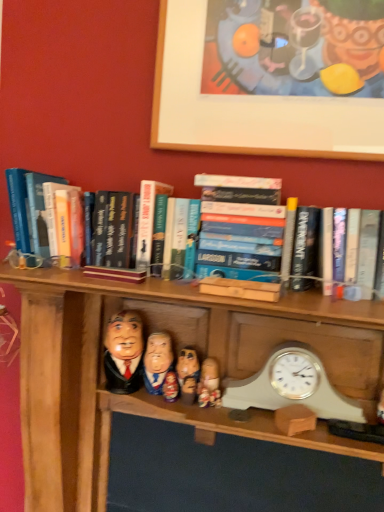
The image size is (384, 512). What do you see at coordinates (204, 398) in the screenshot? I see `wooden figurine at center, the 1th toy from the right` at bounding box center [204, 398].

The height and width of the screenshot is (512, 384). What do you see at coordinates (240, 228) in the screenshot?
I see `hardcover book at center` at bounding box center [240, 228].

What do you see at coordinates (350, 251) in the screenshot? I see `hardcover books at right` at bounding box center [350, 251].

What do you see at coordinates (247, 106) in the screenshot? I see `wooden picture frame at upper center` at bounding box center [247, 106].

Find the location of a particular element. matte plastic head at center, the 1th person viewed from the left is located at coordinates (124, 352).

Considering their positions, is matte plastic head at center, the fourth person in the right-to-left sequence, located in front of or behind hardcover book at center?

In the image, matte plastic head at center, the fourth person in the right-to-left sequence, appears behind hardcover book at center.

Is matte plastic head at center, the fourth person in the right-to-left sequence, oriented towards hardcover book at center?

No, matte plastic head at center, the fourth person in the right-to-left sequence, is not aimed at hardcover book at center.

Does matte plastic head at center, the 1th person viewed from the left, appear on the right side of hardcover book at center?

In fact, matte plastic head at center, the 1th person viewed from the left, is to the left of hardcover book at center.

Between wooden picture frame at upper center and matte plastic head at center, the 1th person viewed from the left, which one has smaller width?

With smaller width is wooden picture frame at upper center.

Is wooden picture frame at upper center bigger than matte plastic head at center, the fourth person in the right-to-left sequence?

A: Yes.

Is matte plastic head at center, the 1th person viewed from the left, inside wooden picture frame at upper center?

No, matte plastic head at center, the 1th person viewed from the left, is located outside of wooden picture frame at upper center.

Identify the location of picture frame that appears above the matte plastic head at center, the 1th person viewed from the left (from a real-world perspective). (247, 106).

Considering the positions of objects wooden doll at center, arranged as the first toy when viewed from the left, and hardcover books at right in the image provided, who is more to the left, wooden doll at center, arranged as the first toy when viewed from the left, or hardcover books at right?

Positioned to the left is wooden doll at center, arranged as the first toy when viewed from the left.

Which is in front, point (168, 374) or point (362, 232)?

The point (362, 232) is closer.

Could you measure the distance between wooden doll at center, which is the 3th toy in right-to-left order, and hardcover books at right?

The distance of wooden doll at center, which is the 3th toy in right-to-left order, from hardcover books at right is 19.38 inches.

Would you say hardcover books at right is part of wooden doll at center, which is the 3th toy in right-to-left order,'s contents?

No, hardcover books at right is not surrounded by wooden doll at center, which is the 3th toy in right-to-left order.

Looking at their sizes, would you say hardcover book at center is wider or thinner than wooden figurine at center, arranged as the second toy when viewed from the right?

Clearly, hardcover book at center has more width compared to wooden figurine at center, arranged as the second toy when viewed from the right.

Is wooden figurine at center, arranged as the second toy when viewed from the right, located within hardcover book at center?

No, wooden figurine at center, arranged as the second toy when viewed from the right, is not surrounded by hardcover book at center.

In the scene shown: From a real-world perspective, does hardcover book at center sit lower than wooden figurine at center, arranged as the second toy when viewed from the right?

Incorrect, from a real-world perspective, hardcover book at center is higher than wooden figurine at center, arranged as the second toy when viewed from the right.

Does hardcover book at center touch wooden figurine at center, the 2th toy positioned from the left?

No, hardcover book at center is not with wooden figurine at center, the 2th toy positioned from the left.

Which object is positioned more to the left, hardcover book at center or wooden doll at center, arranged as the first toy when viewed from the left?

wooden doll at center, arranged as the first toy when viewed from the left, is more to the left.

Which of these two, hardcover book at center or wooden doll at center, arranged as the first toy when viewed from the left, is bigger?

hardcover book at center is bigger.

Consider the image. How much distance is there between hardcover book at center and wooden doll at center, arranged as the first toy when viewed from the left?

hardcover book at center is 15.18 inches away from wooden doll at center, arranged as the first toy when viewed from the left.

Can you see hardcover book at center touching wooden doll at center, arranged as the first toy when viewed from the left?

There is a gap between hardcover book at center and wooden doll at center, arranged as the first toy when viewed from the left.

Which is correct: wooden figurine at center, the 2th toy positioned from the left, is inside wooden figurine at center, placed as the 3th person when sorted from right to left, or outside of it?

wooden figurine at center, the 2th toy positioned from the left, is outside wooden figurine at center, placed as the 3th person when sorted from right to left.

Looking at this image, is wooden figurine at center, the 2th toy positioned from the left, with wooden figurine at center, the second person positioned from the left?

Yes, the surface of wooden figurine at center, the 2th toy positioned from the left, is in contact with wooden figurine at center, the second person positioned from the left.

Consider the image. Measure the distance from wooden figurine at center, arranged as the second toy when viewed from the right, to wooden figurine at center, placed as the 3th person when sorted from right to left.

A distance of 3.31 inches exists between wooden figurine at center, arranged as the second toy when viewed from the right, and wooden figurine at center, placed as the 3th person when sorted from right to left.

Is wooden figurine at center, arranged as the second toy when viewed from the right, smaller than wooden figurine at center, placed as the 3th person when sorted from right to left?

Correct, wooden figurine at center, arranged as the second toy when viewed from the right, occupies less space than wooden figurine at center, placed as the 3th person when sorted from right to left.

Looking at this image, between wooden figurine at center, the 2th toy positioned from the left, and wooden figurine at center, which is counted as the first person, starting from the right, which one appears on the left side from the viewer's perspective?

Positioned to the left is wooden figurine at center, the 2th toy positioned from the left.

From the image's perspective, is wooden figurine at center, the 2th toy positioned from the left, on wooden figurine at center, acting as the fourth person starting from the left?

No, from the image's perspective, wooden figurine at center, the 2th toy positioned from the left, is not on top of wooden figurine at center, acting as the fourth person starting from the left.

Is wooden figurine at center, the 2th toy positioned from the left, spatially inside wooden figurine at center, acting as the fourth person starting from the left, or outside of it?

The correct answer is: outside.

Which of these two, wooden figurine at center, the 2th toy positioned from the left, or wooden figurine at center, which is counted as the first person, starting from the right, is smaller?

wooden figurine at center, the 2th toy positioned from the left, is smaller.

Identify the location of paperback book in front of the matte plastic head at center, the 1th person viewed from the left. The width and height of the screenshot is (384, 512). (240, 228).

Identify the location of picture frame located above the matte plastic head at center, the fourth person in the right-to-left sequence (from a real-world perspective). (247, 106).

Which object lies further to the anchor point hardcover books at right, wooden picture frame at upper center or wooden doll at center, which is the 3th toy in right-to-left order?

Among the two, wooden doll at center, which is the 3th toy in right-to-left order, is located further to hardcover books at right.

When comparing their distances from wooden figurine at center, the 2th toy positioned from the left, does wooden doll at center, which is the 3th toy in right-to-left order, or hardcover book at center seem closer?

wooden doll at center, which is the 3th toy in right-to-left order, is positioned closer to the anchor wooden figurine at center, the 2th toy positioned from the left.

Which object lies further to the anchor point wooden picture frame at upper center, matte plastic head at center, the fourth person in the right-to-left sequence, or wooden figurine at center, the 2th toy positioned from the left?

wooden figurine at center, the 2th toy positioned from the left, is positioned further to the anchor wooden picture frame at upper center.

Looking at the image, which one is located closer to wooden picture frame at upper center, wooden figurine at center, which is the third toy in left-to-right order, or wooden figurine at center, which is counted as the first person, starting from the right?

wooden figurine at center, which is counted as the first person, starting from the right, lies closer to wooden picture frame at upper center than the other object.

From the picture: Which object lies further to the anchor point wooden figurine at center, which is counted as the first person, starting from the right, hardcover book at center or hardcover books at right?

hardcover books at right is further to wooden figurine at center, which is counted as the first person, starting from the right.

In the scene shown: Based on their spatial positions, is wooden figurine at center, acting as the fourth person starting from the left, or wooden doll at center, arranged as the first toy when viewed from the left, closer to wooden doll at center, the second person viewed from the right?

Among the two, wooden doll at center, arranged as the first toy when viewed from the left, is located nearer to wooden doll at center, the second person viewed from the right.

Based on their spatial positions, is hardcover book at center or wooden figurine at center, the 1th toy from the right, further from wooden doll at center, the second person viewed from the right?

Among the two, hardcover book at center is located further to wooden doll at center, the second person viewed from the right.

Based on their spatial positions, is wooden doll at center, arranged as the first toy when viewed from the left, or wooden figurine at center, placed as the 3th person when sorted from right to left, closer to wooden figurine at center, the 2th toy positioned from the left?

The object closer to wooden figurine at center, the 2th toy positioned from the left, is wooden doll at center, arranged as the first toy when viewed from the left.

Identify the location of paperback book between matte plastic head at center, the 1th person viewed from the left, and hardcover books at right, in the horizontal direction. point(240,228).

Identify the location of paperback book between wooden picture frame at upper center and wooden figurine at center, the 2th toy positioned from the left, in the up-down direction. This screenshot has height=512, width=384. (240, 228).

Image resolution: width=384 pixels, height=512 pixels. What are the coordinates of `person between wooden figurine at center, the second person positioned from the left, and wooden figurine at center, the 2th toy positioned from the left, from left to right` in the screenshot? It's located at (188, 374).

This screenshot has height=512, width=384. In order to click on clock that lies between hardcover book at center and wooden figurine at center, the 2th toy positioned from the left, from top to bottom in this screenshot , I will do `click(291, 386)`.